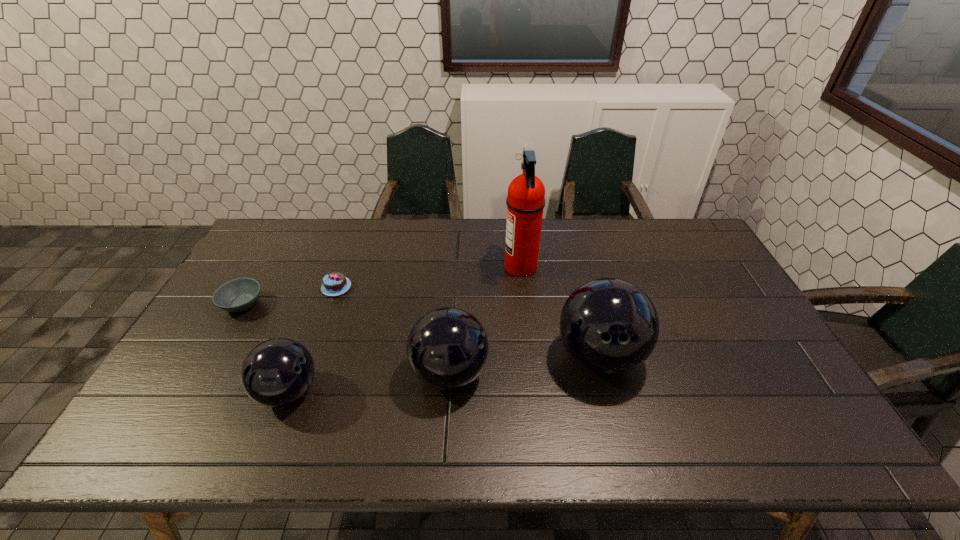
Find the location of a particular element. This screenshot has height=540, width=960. vacant area between the second bowling ball from right to left and the chocolate cake is located at coordinates (393, 330).

This screenshot has width=960, height=540. What are the coordinates of `empty space between the chocolate cake and the tallest object` in the screenshot? It's located at (428, 277).

Locate an element on the screen. The width and height of the screenshot is (960, 540). empty space between the tallest bowling ball and the fifth object from left to right is located at coordinates (561, 312).

Where is `object that ranks as the fourth closest to the tallest object`? object that ranks as the fourth closest to the tallest object is located at coordinates (277, 372).

Choose which object is the nearest neighbor to the second tallest object. Please provide its 2D coordinates. Your answer should be formatted as a tuple, i.e. [(x, y)], where the tuple contains the x and y coordinates of a point satisfying the conditions above.

[(525, 202)]

At what (x,y) coordinates should I click in order to perform the action: click on bowling ball that is the second closest to the tallest object. Please return your answer as a coordinate pair (x, y). The image size is (960, 540). Looking at the image, I should click on (447, 348).

Select which bowling ball is the closest to the leftmost bowling ball. Please provide its 2D coordinates. Your answer should be formatted as a tuple, i.e. [(x, y)], where the tuple contains the x and y coordinates of a point satisfying the conditions above.

[(447, 348)]

The image size is (960, 540). Find the location of `vacant space that satisfies the following two spatial constraints: 1. on the side of the rightmost bowling ball with the finger holes; 2. on the side of the leftmost bowling ball with the finger holes`. vacant space that satisfies the following two spatial constraints: 1. on the side of the rightmost bowling ball with the finger holes; 2. on the side of the leftmost bowling ball with the finger holes is located at coordinates (609, 392).

In order to click on free region that satisfies the following two spatial constraints: 1. on the side of the rightmost bowling ball with the finger holes; 2. on the side of the leftmost bowling ball with the finger holes in this screenshot , I will do `click(609, 392)`.